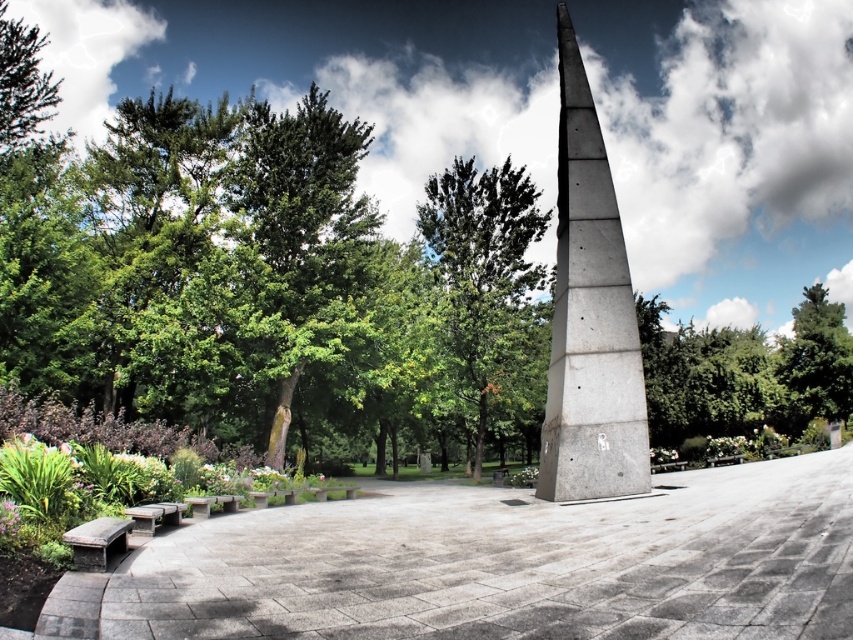
Question: Is concrete gray obelisk at center positioned behind green leafy tree at center?

Choices:
 (A) yes
 (B) no

Answer: (B)

Question: Is gray concrete bench at lower left bigger than green leafy tree at center?

Choices:
 (A) yes
 (B) no

Answer: (B)

Question: Considering the real-world distances, which object is closest to the concrete gray obelisk at center?

Choices:
 (A) green leafy tree at upper right
 (B) green leafy tree at center
 (C) gray concrete bench at lower left

Answer: (C)

Question: Based on their relative distances, which object is farther from the green leafy tree at center?

Choices:
 (A) green leafy tree at upper right
 (B) gray concrete bench at lower left
 (C) concrete gray obelisk at center

Answer: (A)

Question: Which object is farther from the camera taking this photo?

Choices:
 (A) wooden bench at lower left
 (B) concrete gray obelisk at center

Answer: (B)

Question: Can you confirm if green leafy tree at center is bigger than wooden bench at lower left?

Choices:
 (A) no
 (B) yes

Answer: (B)